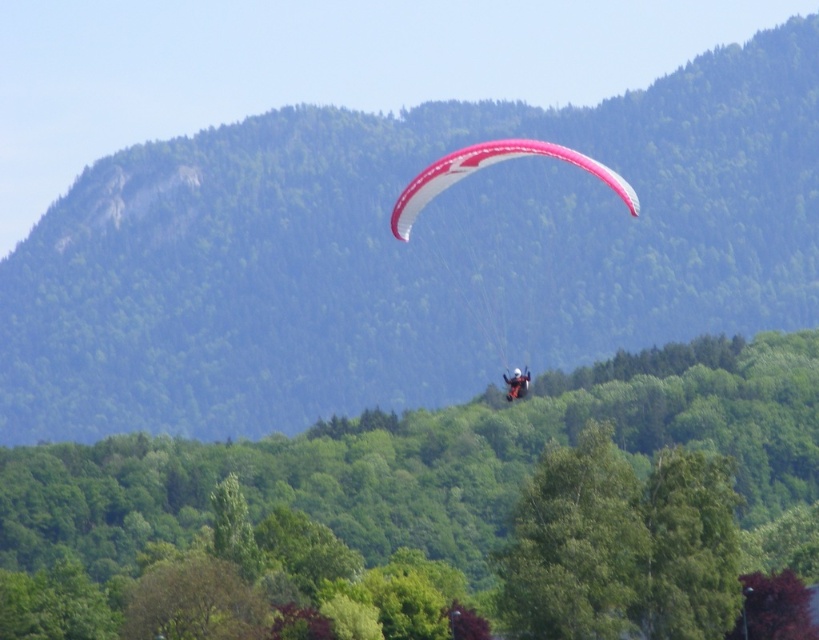
Question: Is green leafy hillside at center positioned at the back of white matte parachute at upper center?

Choices:
 (A) yes
 (B) no

Answer: (A)

Question: Can you confirm if green leafy hillside at center is thinner than green leafy tree at center?

Choices:
 (A) yes
 (B) no

Answer: (B)

Question: Which object appears closest to the camera in this image?

Choices:
 (A) white matte parachute at upper center
 (B) pink fabric parachute at center

Answer: (B)

Question: Estimate the real-world distances between objects in this image. Which object is farther from the green leafy hillside at center?

Choices:
 (A) green leafy tree at center
 (B) white matte parachute at upper center
 (C) pink fabric parachute at center

Answer: (B)

Question: Is green leafy hillside at center to the right of pink fabric parachute at center from the viewer's perspective?

Choices:
 (A) no
 (B) yes

Answer: (A)

Question: Estimate the real-world distances between objects in this image. Which object is farther from the white matte parachute at upper center?

Choices:
 (A) green leafy tree at center
 (B) green leafy hillside at center
 (C) pink fabric parachute at center

Answer: (B)